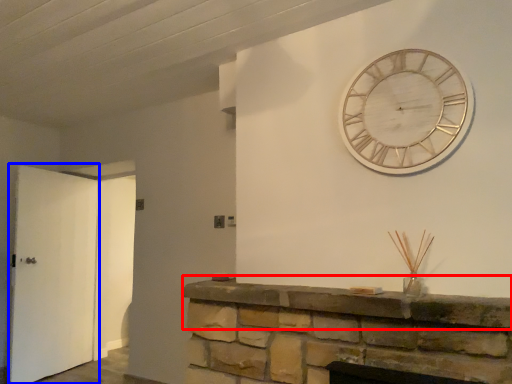
Question: Which object is closer to the camera taking this photo, mantle (highlighted by a red box) or door (highlighted by a blue box)?

Choices:
 (A) mantle
 (B) door

Answer: (A)